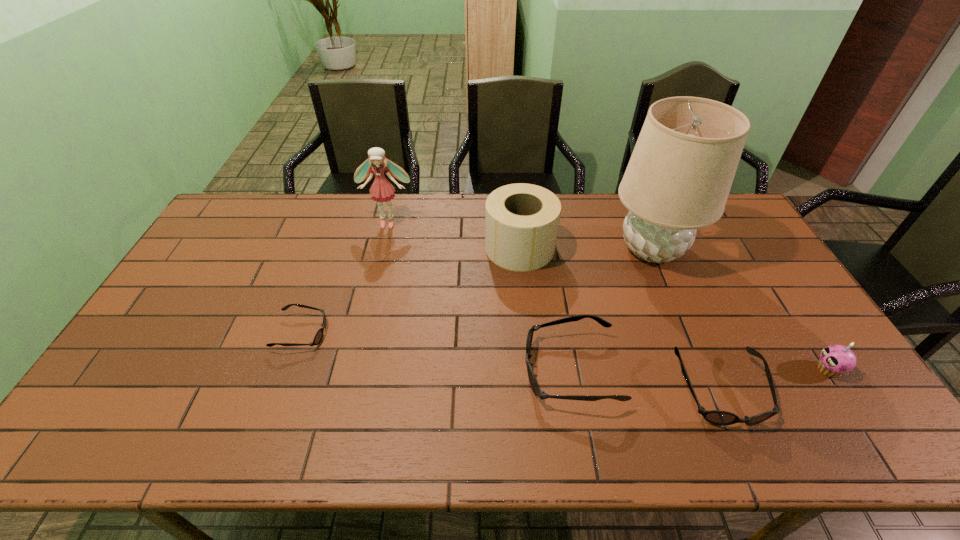
This screenshot has height=540, width=960. What are the coordinates of `free space located 0.330m on the face of the fourth shortest object` in the screenshot? It's located at (687, 369).

Identify the location of doll situated at the far edge. This screenshot has width=960, height=540. (382, 190).

You are a GUI agent. You are given a task and a screenshot of the screen. Output one action in this format:
    pyautogui.click(x=<x>, y=<y>)
    Task: Click on the lampshade that is at the far edge
    
    Given the screenshot: What is the action you would take?
    pyautogui.click(x=678, y=179)

Where is `toilet tissue that is at the far edge`? toilet tissue that is at the far edge is located at coordinates (521, 220).

Where is `cupcake at the near edge`? cupcake at the near edge is located at coordinates (835, 360).

Identify the location of object that is at the right edge. (835, 360).

Locate an element on the screen. object at the near right corner is located at coordinates (835, 360).

This screenshot has width=960, height=540. I want to click on vacant space at the far edge of the desktop, so click(469, 217).

Find the location of a particular element. The width and height of the screenshot is (960, 540). vacant position at the near edge of the desktop is located at coordinates (657, 399).

The width and height of the screenshot is (960, 540). Identify the location of free space at the right edge. (745, 285).